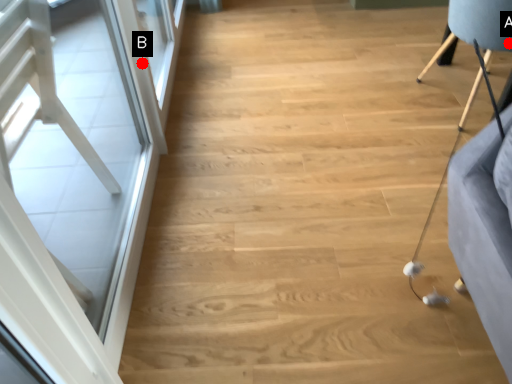
Question: Two points are circled on the image, labeled by A and B beside each circle. Which of the following is the farthest from the observer?

Choices:
 (A) A is further
 (B) B is further

Answer: (A)